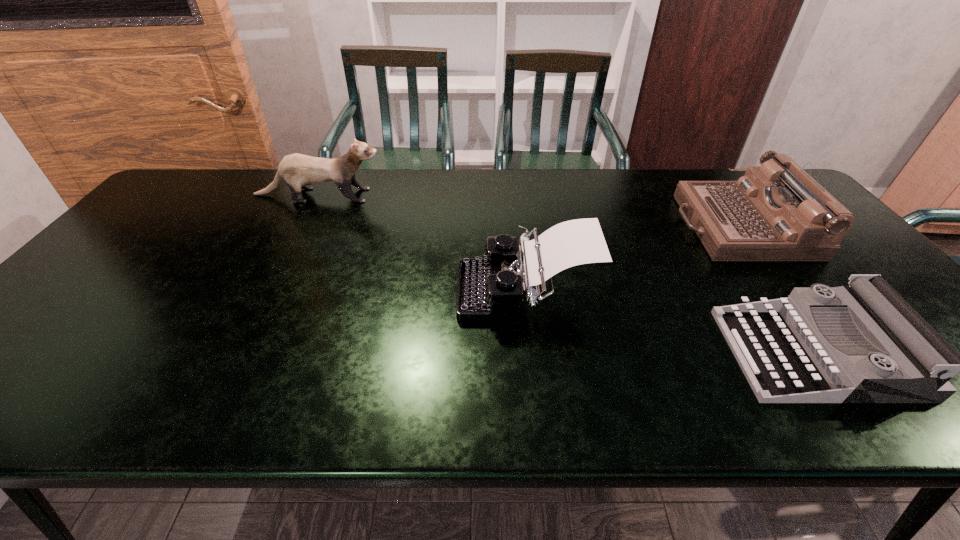
The image size is (960, 540). I want to click on free point between the leftmost object and the shortest typewriter, so click(x=567, y=274).

The width and height of the screenshot is (960, 540). Identify the location of free space between the shortest typewriter and the third object from right to left. (670, 322).

Find the location of a particular element. The height and width of the screenshot is (540, 960). unoccupied area between the shortest typewriter and the leftmost typewriter is located at coordinates (670, 322).

Locate an element on the screen. vacant space in between the shortest typewriter and the leftmost typewriter is located at coordinates (670, 322).

Where is `the second closest object to the shortest typewriter`? Image resolution: width=960 pixels, height=540 pixels. the second closest object to the shortest typewriter is located at coordinates (488, 289).

Locate which object ranks in proximity to the shortest object. Please provide its 2D coordinates. Your answer should be formatted as a tuple, i.e. [(x, y)], where the tuple contains the x and y coordinates of a point satisfying the conditions above.

[(776, 212)]

In order to click on typewriter that can be found as the second closest to the ferret in this screenshot , I will do [x=776, y=212].

Select which typewriter is the second closest to the shortest typewriter. Please provide its 2D coordinates. Your answer should be formatted as a tuple, i.e. [(x, y)], where the tuple contains the x and y coordinates of a point satisfying the conditions above.

[(488, 289)]